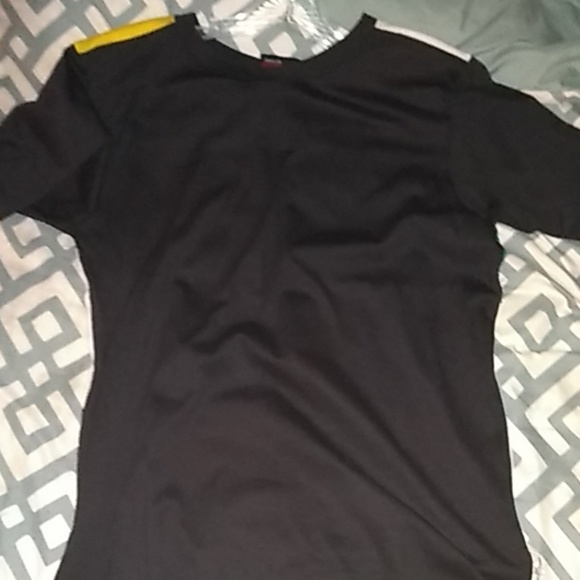
Find the location of a particular element. The image size is (580, 580). yellow fabric is located at coordinates (130, 35).